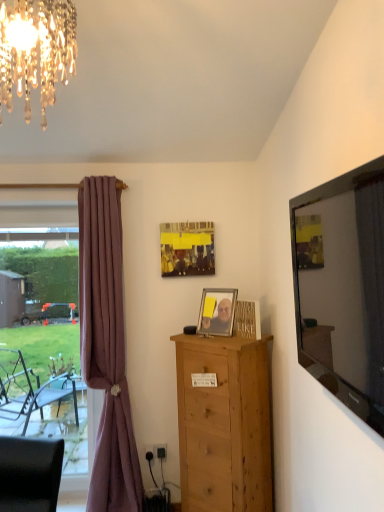
Question: From a real-world perspective, is flat glass mirror at right above or below natural wood chest of drawers at center?

Choices:
 (A) below
 (B) above

Answer: (B)

Question: Which is correct: flat glass mirror at right is inside natural wood chest of drawers at center, or outside of it?

Choices:
 (A) outside
 (B) inside

Answer: (A)

Question: Which is nearer to the natural wood chest of drawers at center?

Choices:
 (A) matte yellow picture frame at center, the 1th picture frame in the back-to-front sequence
 (B) metallic silver picture frame at center, acting as the first picture frame starting from the bottom
 (C) crystal glass chandelier at upper left
 (D) clear glass window at left
 (E) flat glass mirror at right

Answer: (B)

Question: Which is nearer to the crystal glass chandelier at upper left?

Choices:
 (A) metallic silver picture frame at center, the 1th picture frame from the front
 (B) matte yellow picture frame at center, marked as the 2th picture frame in a bottom-to-top arrangement
 (C) mauve fabric curtain at left
 (D) flat glass mirror at right
 (E) natural wood chest of drawers at center

Answer: (B)